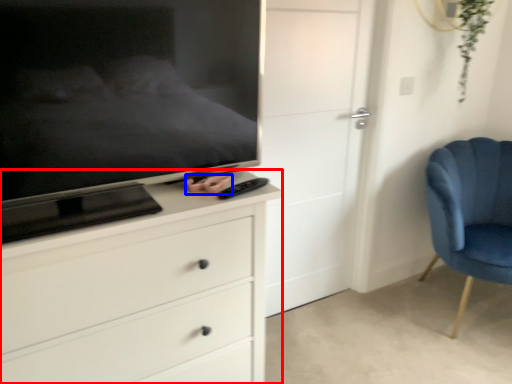
Question: Which of the following is the closest to the observer, chest of drawers (highlighted by a red box) or hand (highlighted by a blue box)?

Choices:
 (A) chest of drawers
 (B) hand

Answer: (A)